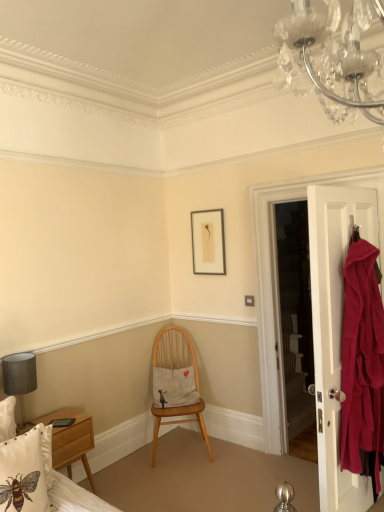
What do you see at coordinates (23, 474) in the screenshot? This screenshot has width=384, height=512. I see `white cotton pillow with bee design at lower left, the first pillow when ordered from front to back` at bounding box center [23, 474].

The image size is (384, 512). Describe the element at coordinates (208, 242) in the screenshot. I see `matte black picture frame at upper center` at that location.

Describe the element at coordinates (43, 477) in the screenshot. I see `white cotton bed at lower left` at that location.

At what (x,y) coordinates should I click in order to perform the action: click on white cotton pillow with bee design at lower left, the first pillow when ordered from front to back. Please return your answer as a coordinate pair (x, y). The width and height of the screenshot is (384, 512). Looking at the image, I should click on (23, 474).

From a real-world perspective, is white cotton bed at lower left physically located above or below matte gray lampshade at left?

white cotton bed at lower left is below matte gray lampshade at left.

Does white cotton bed at lower left have a lesser height compared to matte gray lampshade at left?

No.

Is white cotton bed at lower left oriented away from matte gray lampshade at left?

That's not correct — white cotton bed at lower left is not looking away from matte gray lampshade at left.

Which object is further away from the camera, white cotton bed at lower left or matte gray lampshade at left?

matte gray lampshade at left is behind.

In the image, there is a matte gray lampshade at left. Where is `door above it (from the image's perspective)`? The width and height of the screenshot is (384, 512). door above it (from the image's perspective) is located at coordinates (334, 329).

Is matte white door at right far away from matte gray lampshade at left?

Yes, matte white door at right and matte gray lampshade at left are located far from each other.

Looking at the image, does matte white door at right seem bigger or smaller compared to matte gray lampshade at left?

matte white door at right is bigger than matte gray lampshade at left.

Is point (328, 335) positioned before point (27, 368)?

Yes.

Looking at this image, from the image's perspective, between wooden chair at center and white cotton pillow with bee design at lower left, which is counted as the first pillow, starting from the left, who is located below?

wooden chair at center appears lower in the image.

Who is bigger, wooden chair at center or white cotton pillow with bee design at lower left, which is counted as the second pillow, starting from the back?

wooden chair at center is bigger.

From the picture: Between wooden chair at center and white cotton pillow with bee design at lower left, which is counted as the first pillow, starting from the left, which one has larger width?

wooden chair at center is wider.

Is the surface of wooden chair at center in direct contact with white cotton pillow with bee design at lower left, which appears as the 2th pillow when viewed from the right?

No, wooden chair at center is not with white cotton pillow with bee design at lower left, which appears as the 2th pillow when viewed from the right.

Is matte white door at right beside wooden chair at center?

matte white door at right and wooden chair at center are clearly separated.

Based on the photo, which is nearer, (311,260) or (155,432)?

The point (311,260) is closer to the camera.

Is matte white door at right turned away from wooden chair at center?

No, matte white door at right is not facing away from wooden chair at center.

Does point (160, 383) lie in front of point (43, 475)?

That is False.

Is wooden chair at center oriented towards white cotton bed at lower left?

No.

Looking at this image, considering the sizes of wooden chair at center and white cotton bed at lower left in the image, is wooden chair at center wider or thinner than white cotton bed at lower left?

wooden chair at center is wider than white cotton bed at lower left.

Does wooden chair at center have a larger size compared to white cotton bed at lower left?

Indeed, wooden chair at center has a larger size compared to white cotton bed at lower left.

Between white cotton cushion at center, which is the first pillow from back to front, and matte black picture frame at upper center, which one is positioned in front?

white cotton cushion at center, which is the first pillow from back to front, is closer to the camera.

Considering the relative sizes of white cotton cushion at center, the first pillow viewed from the right, and matte black picture frame at upper center in the image provided, is white cotton cushion at center, the first pillow viewed from the right, taller than matte black picture frame at upper center?

Incorrect, the height of white cotton cushion at center, the first pillow viewed from the right, is not larger of that of matte black picture frame at upper center.

There is a matte black picture frame at upper center. Identify the location of the 2nd pillow below it (from the image's perspective). (175, 387).

Between wooden chair at center and white cotton cushion at center, the first pillow viewed from the right, which one has larger size?

Bigger between the two is wooden chair at center.

Is point (190, 420) positioned after point (170, 384)?

Yes, it is behind point (170, 384).

From a real-world perspective, is wooden chair at center positioned above or below white cotton cushion at center, which is the first pillow from back to front?

wooden chair at center is situated lower than white cotton cushion at center, which is the first pillow from back to front, in the real world.

Who is shorter, wooden chair at center or white cotton cushion at center, the first pillow viewed from the right?

Standing shorter between the two is white cotton cushion at center, the first pillow viewed from the right.

Locate an element on the screen. The image size is (384, 512). lamp on the left of white cotton bed at lower left is located at coordinates (20, 379).

Where is `lamp located below the matte white door at right (from the image's perspective)`? lamp located below the matte white door at right (from the image's perspective) is located at coordinates click(x=20, y=379).

Estimate the real-world distances between objects in this image. Which object is further from matte gray lampshade at left, matte black picture frame at upper center or wooden chair at center?

matte black picture frame at upper center lies further to matte gray lampshade at left than the other object.

Based on their spatial positions, is wooden chair at center or white cotton cushion at center, the 2th pillow in the front-to-back sequence, further from white cotton pillow with bee design at lower left, which appears as the 2th pillow when viewed from the right?

wooden chair at center is positioned further to the anchor white cotton pillow with bee design at lower left, which appears as the 2th pillow when viewed from the right.

Based on the photo, which object lies nearer to the anchor point white cotton bed at lower left, matte gray lampshade at left or wooden chair at center?

matte gray lampshade at left is positioned closer to the anchor white cotton bed at lower left.

Looking at the image, which one is located further to white cotton bed at lower left, white cotton cushion at center, which is the first pillow from back to front, or wooden chair at center?

wooden chair at center lies further to white cotton bed at lower left than the other object.

When comparing their distances from white cotton pillow with bee design at lower left, the first pillow when ordered from front to back, does matte black picture frame at upper center or matte gray lampshade at left seem closer?

Among the two, matte gray lampshade at left is located nearer to white cotton pillow with bee design at lower left, the first pillow when ordered from front to back.

Based on their spatial positions, is white cotton pillow with bee design at lower left, which is counted as the second pillow, starting from the back, or matte black picture frame at upper center further from white cotton cushion at center, the 2th pillow in the front-to-back sequence?

white cotton pillow with bee design at lower left, which is counted as the second pillow, starting from the back, is positioned further to the anchor white cotton cushion at center, the 2th pillow in the front-to-back sequence.

Which object lies further to the anchor point matte gray lampshade at left, wooden chair at center or white cotton cushion at center, the first pillow viewed from the right?

Among the two, wooden chair at center is located further to matte gray lampshade at left.

From the image, which object appears to be farther from white cotton pillow with bee design at lower left, which is counted as the first pillow, starting from the left, matte gray lampshade at left or white cotton cushion at center, which is the first pillow from back to front?

white cotton cushion at center, which is the first pillow from back to front, is positioned further to the anchor white cotton pillow with bee design at lower left, which is counted as the first pillow, starting from the left.

The width and height of the screenshot is (384, 512). Find the location of `bed between white cotton pillow with bee design at lower left, which is counted as the first pillow, starting from the left, and matte gray lampshade at left, along the z-axis`. bed between white cotton pillow with bee design at lower left, which is counted as the first pillow, starting from the left, and matte gray lampshade at left, along the z-axis is located at coordinates (43, 477).

Where is `chair between matte gray lampshade at left and matte white door at right from left to right`? chair between matte gray lampshade at left and matte white door at right from left to right is located at coordinates (176, 383).

The image size is (384, 512). I want to click on picture frame situated between white cotton bed at lower left and matte white door at right from left to right, so click(208, 242).

Locate an element on the screen. picture frame situated between matte gray lampshade at left and matte white door at right from left to right is located at coordinates (208, 242).